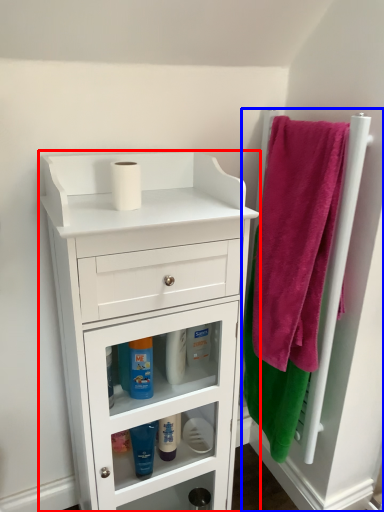
Question: Which point is further to the camera, chest of drawers (highlighted by a red box) or door (highlighted by a blue box)?

Choices:
 (A) chest of drawers
 (B) door

Answer: (B)